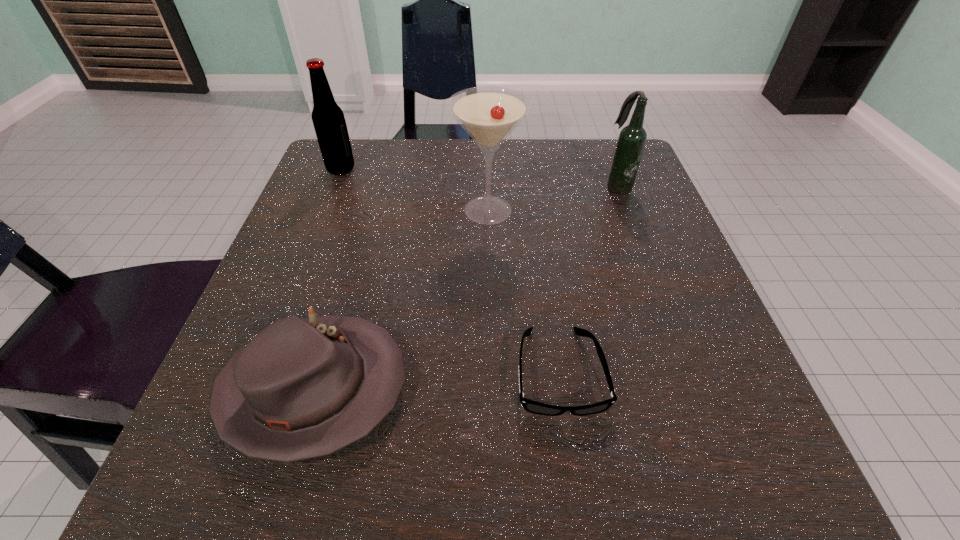
At what (x,y) coordinates should I click in order to perform the action: click on vacant space that is in between the shortest object and the rightmost object. Please return your answer as a coordinate pair (x, y). Image resolution: width=960 pixels, height=540 pixels. Looking at the image, I should click on (588, 279).

You are a GUI agent. You are given a task and a screenshot of the screen. Output one action in this format:
    pyautogui.click(x=<x>, y=<y>)
    Task: Click on the free space between the sunglasses and the martini
    Image resolution: width=960 pixels, height=540 pixels.
    Given the screenshot: What is the action you would take?
    pyautogui.click(x=523, y=291)

The height and width of the screenshot is (540, 960). Identify the location of free point between the martini and the rightmost object. (553, 199).

I want to click on free area in between the martini and the sunglasses, so click(523, 291).

The height and width of the screenshot is (540, 960). Identify the location of vacant space that is in between the hat and the left beer bottle. (327, 279).

This screenshot has height=540, width=960. I want to click on empty space between the shortest object and the farther beer bottle, so click(450, 271).

Locate an element on the screen. The image size is (960, 540). object that ranks as the closest to the martini is located at coordinates (631, 141).

Where is `object that stands as the closest to the hat`? This screenshot has width=960, height=540. object that stands as the closest to the hat is located at coordinates (530, 406).

Locate an element on the screen. The width and height of the screenshot is (960, 540). vacant space that satisfies the following two spatial constraints: 1. on the front-facing side of the shortest object; 2. on the decorative side of the second shortest object is located at coordinates (562, 389).